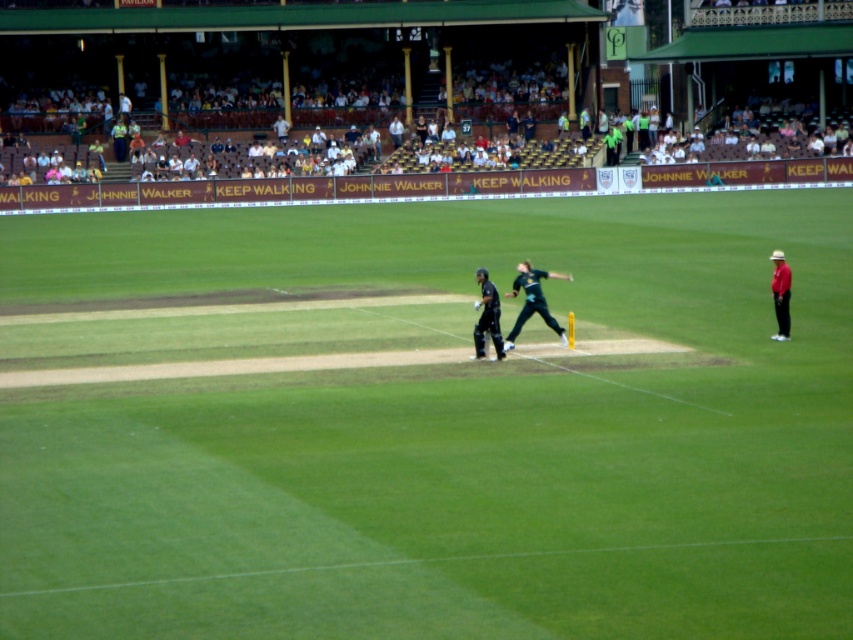
Is point (491, 308) positioned after point (785, 298)?

No, it is in front of (785, 298).

Is dark green uniform at center to the right of red shirt at right from the viewer's perspective?

No, dark green uniform at center is not to the right of red shirt at right.

Which is behind, point (486, 284) or point (786, 317)?

The point (786, 317) is more distant.

The image size is (853, 640). Identify the location of dark green uniform at center. (486, 317).

From the picture: Is dark green jersey at center closer to camera compared to red shirt at right?

Yes, dark green jersey at center is closer to the viewer.

Is point (556, 330) farther from camera compared to point (782, 317)?

That is True.

Between point (509, 332) and point (790, 273), which one is positioned behind?

Positioned behind is point (790, 273).

Find the location of `dark green jersey at center`. dark green jersey at center is located at coordinates (532, 300).

Can you confirm if dark green jersey at center is wider than dark green uniform at center?

Indeed, dark green jersey at center has a greater width compared to dark green uniform at center.

Looking at this image, does dark green jersey at center have a lesser width compared to dark green uniform at center?

No, dark green jersey at center is not thinner than dark green uniform at center.

Locate an element on the screen. Image resolution: width=853 pixels, height=640 pixels. dark green jersey at center is located at coordinates (532, 300).